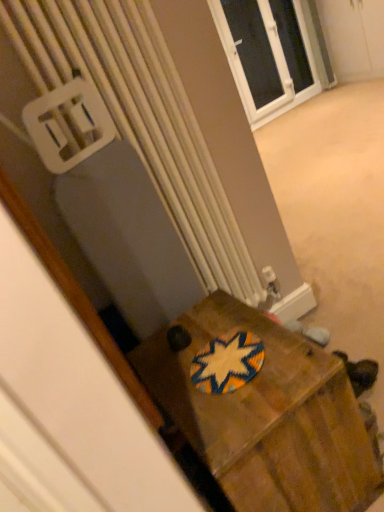
Locate an element on the screen. The width and height of the screenshot is (384, 512). vacant space in woven fabric coaster at center (from a real-world perspective) is located at coordinates (222, 362).